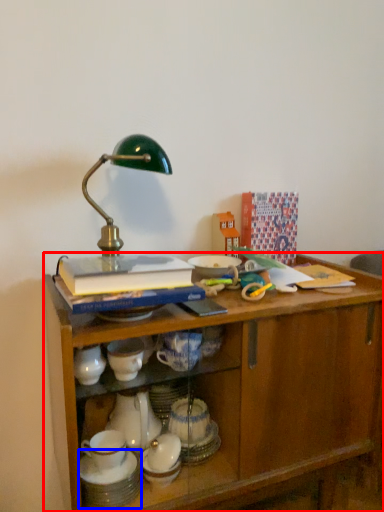
Question: Which of the following is the closest to the observer, desk (highlighted by a red box) or tableware (highlighted by a blue box)?

Choices:
 (A) desk
 (B) tableware

Answer: (A)